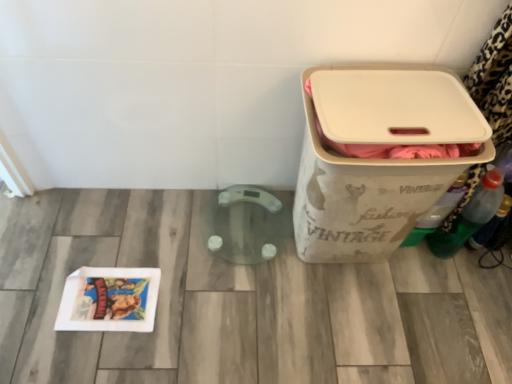
Question: Does beige fabric storage bin at right appear on the left side of translucent plastic bottle at right, the first bottle when ordered from right to left?

Choices:
 (A) no
 (B) yes

Answer: (B)

Question: Does beige fabric storage bin at right lie in front of translucent plastic bottle at right, the first bottle when ordered from right to left?

Choices:
 (A) no
 (B) yes

Answer: (B)

Question: Is beige fabric storage bin at right aimed at translucent plastic bottle at right, marked as the 3th bottle in a left-to-right arrangement?

Choices:
 (A) yes
 (B) no

Answer: (B)

Question: Considering the relative sizes of beige fabric storage bin at right and translucent plastic bottle at right, marked as the 3th bottle in a left-to-right arrangement, in the image provided, is beige fabric storage bin at right wider than translucent plastic bottle at right, marked as the 3th bottle in a left-to-right arrangement,?

Choices:
 (A) yes
 (B) no

Answer: (A)

Question: From the image's perspective, does beige fabric storage bin at right appear lower than translucent plastic bottle at right, the first bottle when ordered from right to left?

Choices:
 (A) yes
 (B) no

Answer: (B)

Question: From a real-world perspective, is beige fabric storage bin at right physically located above or below green plastic bottle at right, arranged as the second bottle when viewed from the right?

Choices:
 (A) below
 (B) above

Answer: (B)

Question: In terms of height, does beige fabric storage bin at right look taller or shorter compared to green plastic bottle at right, arranged as the second bottle when viewed from the right?

Choices:
 (A) short
 (B) tall

Answer: (B)

Question: Would you say beige fabric storage bin at right is to the left or to the right of green plastic bottle at right, the 2th bottle viewed from the left, in the picture?

Choices:
 (A) left
 (B) right

Answer: (A)

Question: Is point (393, 162) positioned closer to the camera than point (467, 230)?

Choices:
 (A) farther
 (B) closer

Answer: (B)

Question: Considering their positions, is translucent plastic bottle at right, the first bottle when ordered from right to left, located in front of or behind green plastic bottle at right, the 2th bottle viewed from the left?

Choices:
 (A) front
 (B) behind

Answer: (B)

Question: Does point (502, 213) appear closer or farther from the camera than point (467, 233)?

Choices:
 (A) closer
 (B) farther

Answer: (A)

Question: From the image's perspective, relative to green plastic bottle at right, the 2th bottle viewed from the left, is translucent plastic bottle at right, marked as the 3th bottle in a left-to-right arrangement, above or below?

Choices:
 (A) above
 (B) below

Answer: (B)

Question: Is translucent plastic bottle at right, the first bottle when ordered from right to left, taller or shorter than green plastic bottle at right, arranged as the second bottle when viewed from the right?

Choices:
 (A) tall
 (B) short

Answer: (B)

Question: Which is correct: translucent plastic bottle at right, marked as the 3th bottle in a left-to-right arrangement, is inside beige fabric storage bin at right, or outside of it?

Choices:
 (A) outside
 (B) inside

Answer: (A)

Question: Would you say translucent plastic bottle at right, the first bottle when ordered from right to left, is to the left or to the right of beige fabric storage bin at right in the picture?

Choices:
 (A) left
 (B) right

Answer: (B)